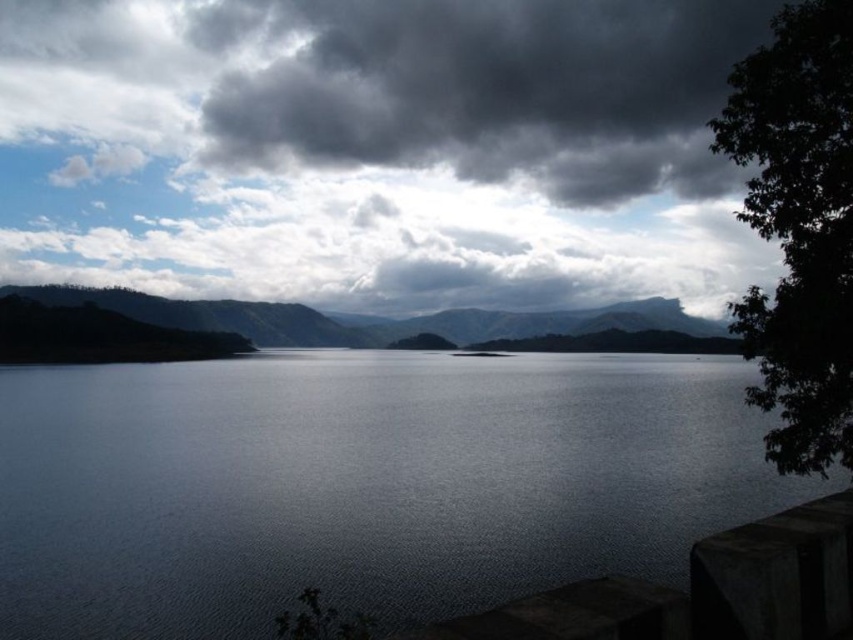
Image resolution: width=853 pixels, height=640 pixels. In order to click on dark gray water at center in this screenshot , I will do `click(360, 483)`.

This screenshot has height=640, width=853. What do you see at coordinates (360, 483) in the screenshot? I see `dark gray water at center` at bounding box center [360, 483].

Where is `dark gray water at center`? dark gray water at center is located at coordinates (360, 483).

Who is shorter, dark gray cloud at upper center or dark green leafy tree at right?

With less height is dark green leafy tree at right.

This screenshot has height=640, width=853. What are the coordinates of `dark gray cloud at upper center` in the screenshot? It's located at (479, 90).

Find the location of a particular element. The height and width of the screenshot is (640, 853). dark gray cloud at upper center is located at coordinates (479, 90).

Locate an element on the screen. This screenshot has height=640, width=853. dark gray cloud at upper center is located at coordinates (479, 90).

Does dark green leafy tree at right appear over green matte mountain at center?

Actually, dark green leafy tree at right is below green matte mountain at center.

Is point (804, 168) in front of point (569, 333)?

Yes, point (804, 168) is in front of point (569, 333).

Is point (811, 362) more distant than point (650, 310)?

No.

Identify the location of dark green leafy tree at right. (798, 227).